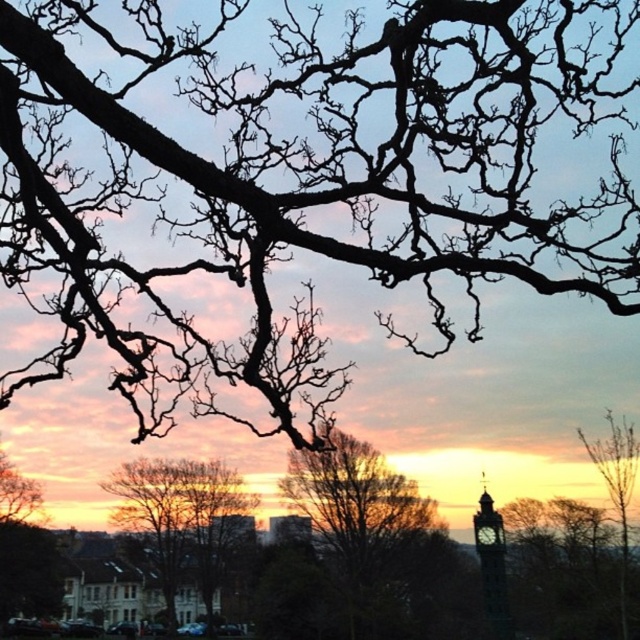
Does point (84, 305) come closer to viewer compared to point (161, 545)?

Yes, it is.

Which of these two, black bare branches at upper center or smooth brown tree at center, stands shorter?

Standing shorter between the two is black bare branches at upper center.

Is point (449, 108) in front of point (243, 488)?

Yes, point (449, 108) is closer to viewer.

This screenshot has height=640, width=640. I want to click on black bare branches at upper center, so click(307, 179).

Looking at this image, can you confirm if black bare branches at upper center is positioned to the left of brown textured tree at center?

Yes, black bare branches at upper center is to the left of brown textured tree at center.

Where is `black bare branches at upper center`? The height and width of the screenshot is (640, 640). black bare branches at upper center is located at coordinates (307, 179).

Find the location of a particular element. The width and height of the screenshot is (640, 640). black bare branches at upper center is located at coordinates (307, 179).

The width and height of the screenshot is (640, 640). Identify the location of dark gray stone clock tower at lower right. click(492, 564).

Does point (480, 547) come in front of point (499, 545)?

That is True.

At what (x,y) coordinates should I click in order to perform the action: click on dark gray stone clock tower at lower right. Please return your answer as a coordinate pair (x, y). Looking at the image, I should click on (492, 564).